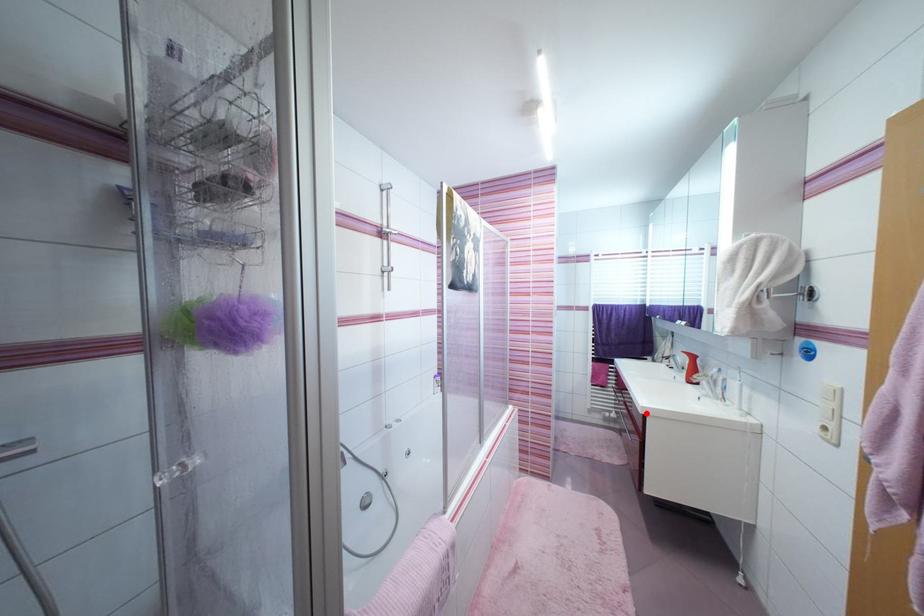
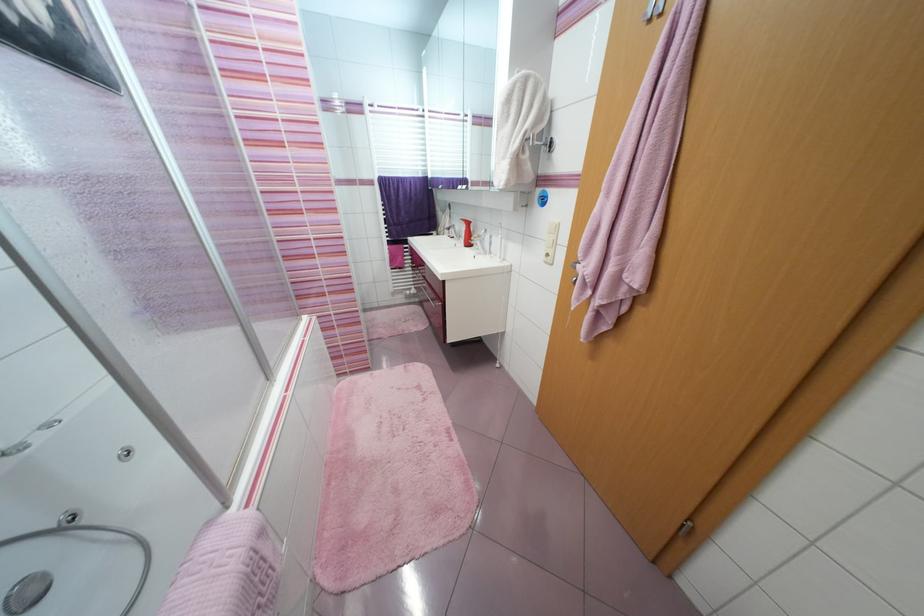
Question: I am providing you with two images of the same scene from different viewpoints. In image1, a red point is highlighted. Considering the same 3D point in image2, which of the following is correct?

Choices:
 (A) It is closer
 (B) It is farther

Answer: (B)